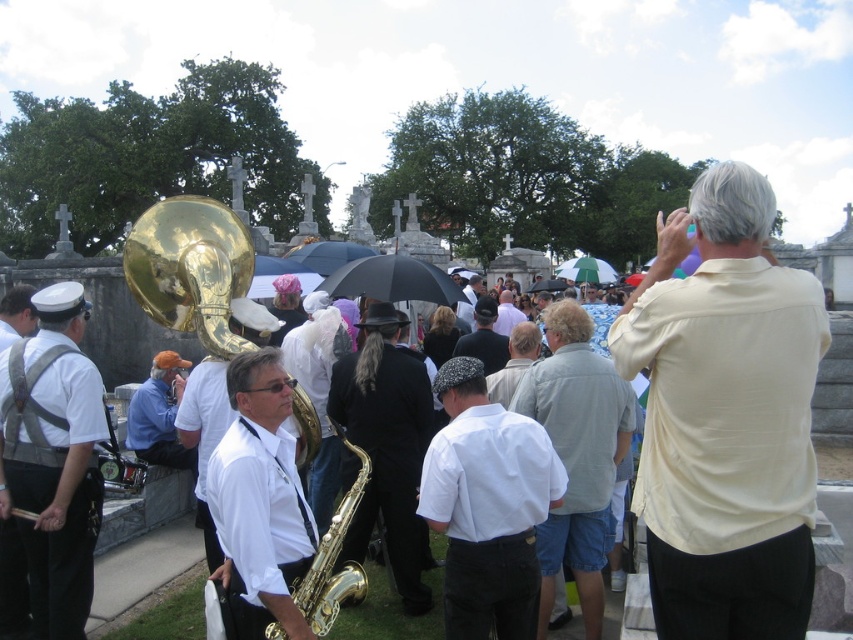
The height and width of the screenshot is (640, 853). What do you see at coordinates (260, 500) in the screenshot?
I see `white glossy saxophone at center` at bounding box center [260, 500].

Does point (294, 609) come behind point (241, 273)?

That is False.

Locate an element on the screen. This screenshot has width=853, height=640. white glossy saxophone at center is located at coordinates (260, 500).

Does light yellow shirt at upper right have a lesser width compared to black matte hat at center?

No, light yellow shirt at upper right is not thinner than black matte hat at center.

Is point (666, 493) farther from viewer compared to point (469, 349)?

That is False.

You are a GUI agent. You are given a task and a screenshot of the screen. Output one action in this format:
    pyautogui.click(x=<x>, y=<y>)
    Task: Click on the light yellow shirt at upper right
    Image resolution: width=853 pixels, height=640 pixels.
    Given the screenshot: What is the action you would take?
    pyautogui.click(x=724, y=417)

Can you confirm if white cotton shirt at center is positioned above light gray cotton shirt at center?

Actually, white cotton shirt at center is below light gray cotton shirt at center.

Which is behind, point (460, 394) or point (548, 316)?

The point (548, 316) is more distant.

Locate an element on the screen. This screenshot has width=853, height=640. white cotton shirt at center is located at coordinates (486, 506).